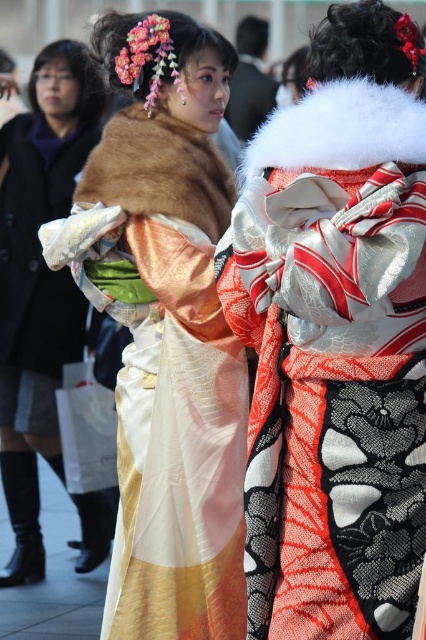
Question: Can you confirm if silky white kimono at center is thinner than fur coat at left?

Choices:
 (A) no
 (B) yes

Answer: (B)

Question: Which point is farther to the camera?

Choices:
 (A) fur coat at left
 (B) silky white kimono at center
 (C) silky kimono at center

Answer: (A)

Question: In this image, where is silky kimono at center located relative to fur coat at left?

Choices:
 (A) above
 (B) below

Answer: (B)

Question: Is silky kimono at center to the right of silky white kimono at center from the viewer's perspective?

Choices:
 (A) no
 (B) yes

Answer: (B)

Question: Considering the real-world distances, which object is farthest from the silky white kimono at center?

Choices:
 (A) silky kimono at center
 (B) fur coat at left

Answer: (B)

Question: Estimate the real-world distances between objects in this image. Which object is farther from the silky white kimono at center?

Choices:
 (A) silky kimono at center
 (B) fur coat at left

Answer: (B)